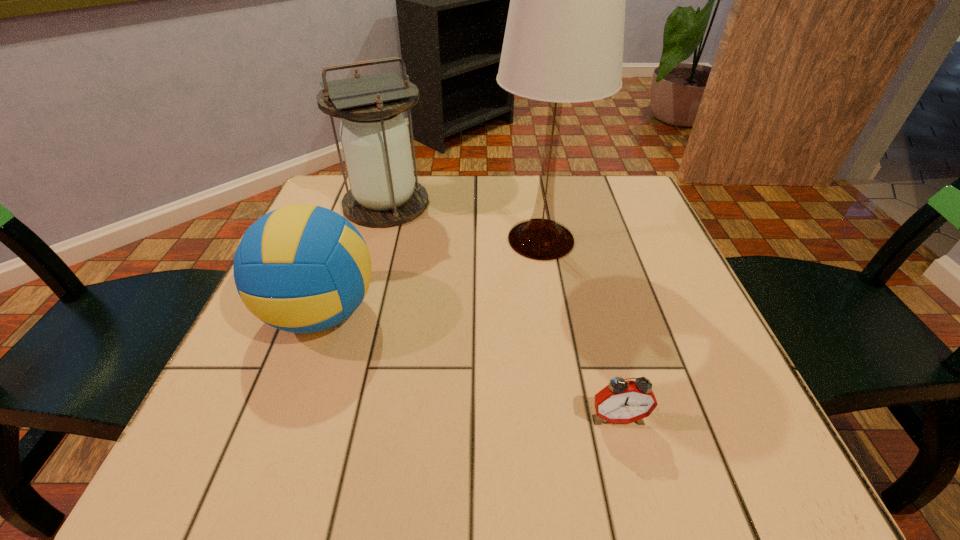
Identify the location of vacant space at the right edge of the desktop. (649, 254).

Identify the location of vacant area at the far left corner of the desktop. (348, 176).

The width and height of the screenshot is (960, 540). In the image, there is a desktop. Identify the location of free region at the far right corner. (604, 213).

Where is `vacant point located between the shortest object and the volleyball`? The width and height of the screenshot is (960, 540). vacant point located between the shortest object and the volleyball is located at coordinates (469, 365).

Find the location of `vacant area that lies between the nearest object and the third farthest object`. vacant area that lies between the nearest object and the third farthest object is located at coordinates 469,365.

Identify the location of unoccupied position between the volleyball and the tallest object. (431, 276).

The image size is (960, 540). Identify the location of empty space between the alarm clock and the lantern. point(502,310).

At what (x,y) coordinates should I click in order to perform the action: click on free space between the shortest object and the volleyball. Please return your answer as a coordinate pair (x, y). This screenshot has height=540, width=960. Looking at the image, I should click on (469, 365).

You are a GUI agent. You are given a task and a screenshot of the screen. Output one action in this format:
    pyautogui.click(x=<x>, y=<y>)
    Task: Click on the empty space between the second shortest object and the table lamp
    The height and width of the screenshot is (540, 960).
    Given the screenshot: What is the action you would take?
    pyautogui.click(x=431, y=276)

Locate an element on the screen. free space between the tallest object and the second nearest object is located at coordinates (431, 276).